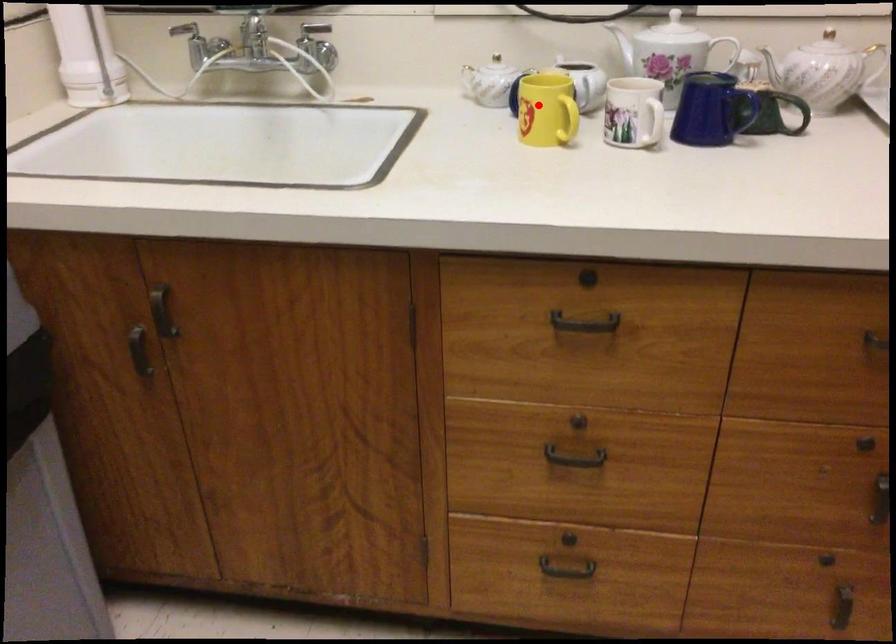
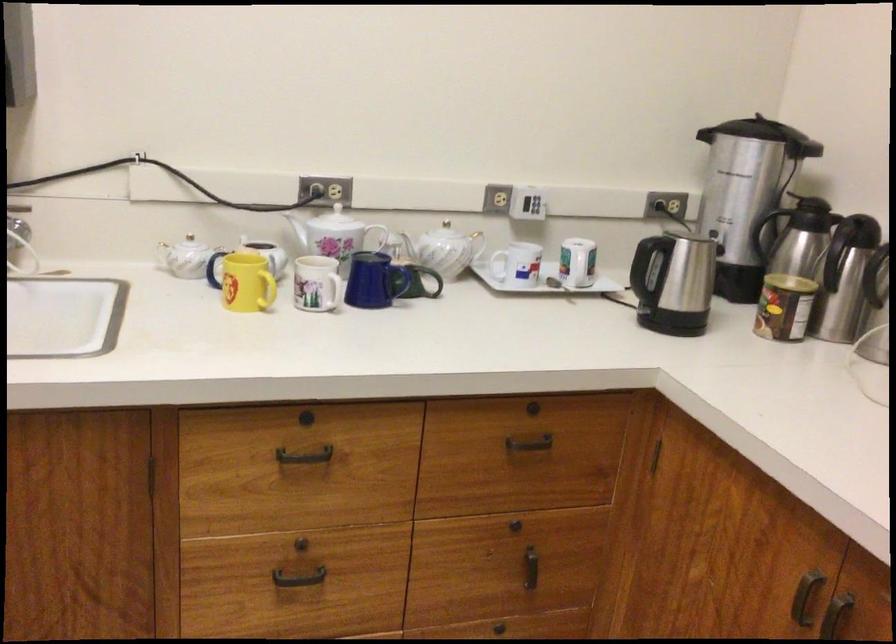
Question: I am providing you with two images of the same scene from different viewpoints. Image1 has a red point marked. In image2, the corresponding 3D location appears at what relative position? Reply with the corresponding letter.

Choices:
 (A) Closer
 (B) Farther

Answer: (B)